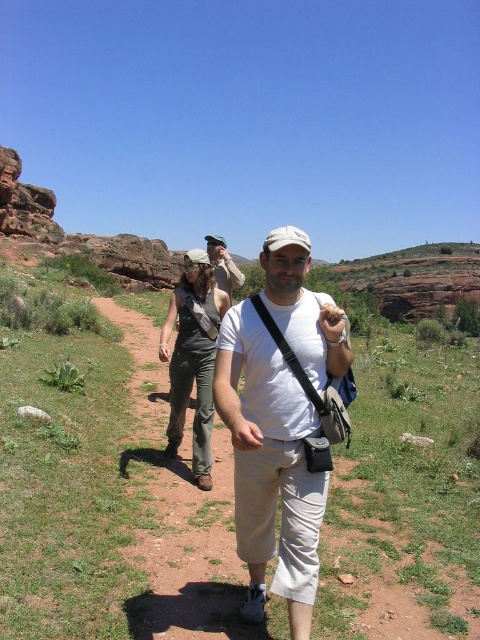
Question: Among these objects, which one is nearest to the camera?

Choices:
 (A) white cotton shirt at center
 (B) denim overalls at center

Answer: (A)

Question: Is the position of denim overalls at center less distant than that of matte khaki pants at center?

Choices:
 (A) yes
 (B) no

Answer: (A)

Question: Among these objects, which one is farthest from the camera?

Choices:
 (A) white cotton shirt at center
 (B) matte khaki pants at center

Answer: (B)

Question: Which object is closer to the camera taking this photo?

Choices:
 (A) matte khaki pants at center
 (B) denim overalls at center
 (C) white cotton shirt at center

Answer: (C)

Question: Can you confirm if white cotton shirt at center is bigger than matte khaki pants at center?

Choices:
 (A) yes
 (B) no

Answer: (B)

Question: Where is white cotton shirt at center located in relation to matte khaki pants at center in the image?

Choices:
 (A) below
 (B) above

Answer: (A)